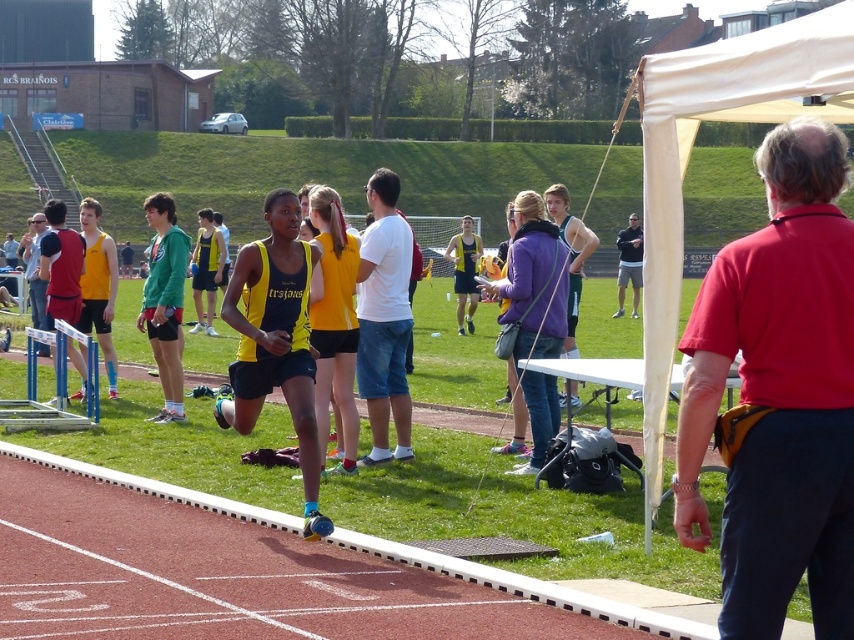
Looking at this image, is red smooth shirt at right wider than yellow matte singlet at center?

In fact, red smooth shirt at right might be narrower than yellow matte singlet at center.

In the scene shown: Can you confirm if red smooth shirt at right is thinner than yellow matte singlet at center?

Correct, red smooth shirt at right's width is less than yellow matte singlet at center's.

Is point (829, 484) positioned after point (97, 301)?

That is False.

Where is `red smooth shirt at right`? The image size is (854, 640). red smooth shirt at right is located at coordinates (779, 396).

Can you confirm if purple fabric jacket at center is positioned to the left of dark gray hoodie at center?

Yes, purple fabric jacket at center is to the left of dark gray hoodie at center.

Who is more distant from viewer, [533,348] or [632,266]?

Point [632,266]

This screenshot has width=854, height=640. In order to click on purple fabric jacket at center in this screenshot , I will do `click(533, 282)`.

The image size is (854, 640). Describe the element at coordinates (275, 340) in the screenshot. I see `yellow matte running suit at center` at that location.

You are a GUI agent. You are given a task and a screenshot of the screen. Output one action in this format:
    pyautogui.click(x=<x>, y=<y>)
    Task: Click on the yellow matte running suit at center
    
    Given the screenshot: What is the action you would take?
    pyautogui.click(x=275, y=340)

Identify the location of yellow matte running suit at center. (275, 340).